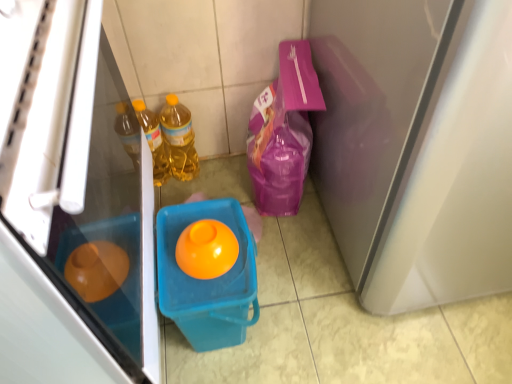
Question: Is matte white screen door at right further to the viewer compared to orange glossy egg at center?

Choices:
 (A) yes
 (B) no

Answer: (B)

Question: From a real-world perspective, is matte white screen door at right over orange glossy egg at center?

Choices:
 (A) yes
 (B) no

Answer: (A)

Question: From the image's perspective, is matte white screen door at right on orange glossy egg at center?

Choices:
 (A) no
 (B) yes

Answer: (B)

Question: Can orange glossy egg at center be found inside matte white screen door at right?

Choices:
 (A) yes
 (B) no

Answer: (B)

Question: Is matte white screen door at right positioned in front of orange glossy egg at center?

Choices:
 (A) no
 (B) yes

Answer: (B)

Question: Can you confirm if matte white screen door at right is shorter than orange glossy egg at center?

Choices:
 (A) no
 (B) yes

Answer: (A)

Question: Is there a large distance between matte plastic refrigerator at left and translucent plastic bucket at center?

Choices:
 (A) yes
 (B) no

Answer: (B)

Question: From the image's perspective, is matte plastic refrigerator at left over translucent plastic bucket at center?

Choices:
 (A) no
 (B) yes

Answer: (B)

Question: Is matte plastic refrigerator at left aimed at translucent plastic bucket at center?

Choices:
 (A) yes
 (B) no

Answer: (A)

Question: Could translucent plastic bucket at center be considered to be inside matte plastic refrigerator at left?

Choices:
 (A) yes
 (B) no

Answer: (B)

Question: Can you confirm if matte plastic refrigerator at left is shorter than translucent plastic bucket at center?

Choices:
 (A) no
 (B) yes

Answer: (A)

Question: Considering the relative sizes of matte plastic refrigerator at left and translucent plastic bucket at center in the image provided, is matte plastic refrigerator at left smaller than translucent plastic bucket at center?

Choices:
 (A) yes
 (B) no

Answer: (B)

Question: Considering the relative positions of matte plastic refrigerator at left and translucent yellow bottle at center, marked as the 2th bottle in a left-to-right arrangement, in the image provided, is matte plastic refrigerator at left behind translucent yellow bottle at center, marked as the 2th bottle in a left-to-right arrangement,?

Choices:
 (A) no
 (B) yes

Answer: (A)